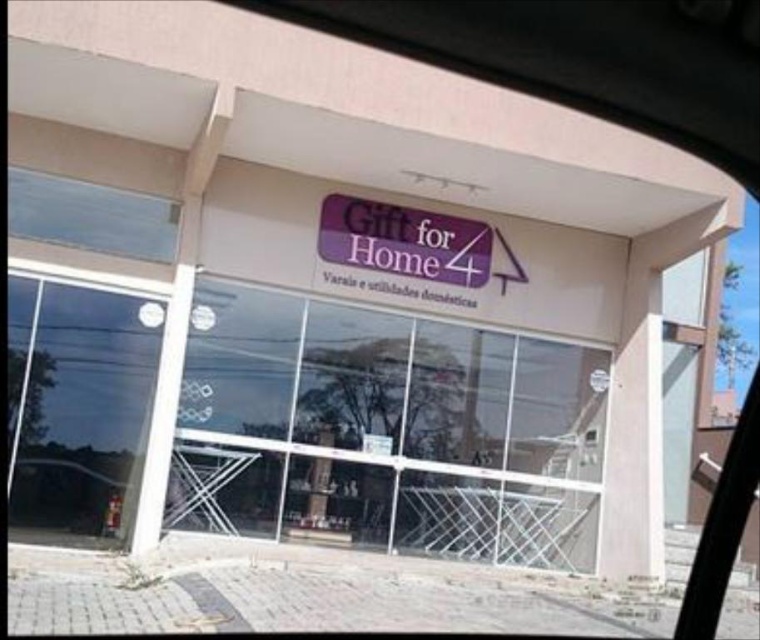
Is point (242, 342) less distant than point (24, 438)?

No, (242, 342) is behind (24, 438).

Which is above, transparent glass at center or transparent glass door at lower left?

transparent glass door at lower left is higher up.

Is point (228, 294) closer to viewer compared to point (154, 381)?

No, (228, 294) is further to viewer.

Locate an element on the screen. The image size is (760, 640). transparent glass at center is located at coordinates (x=385, y=429).